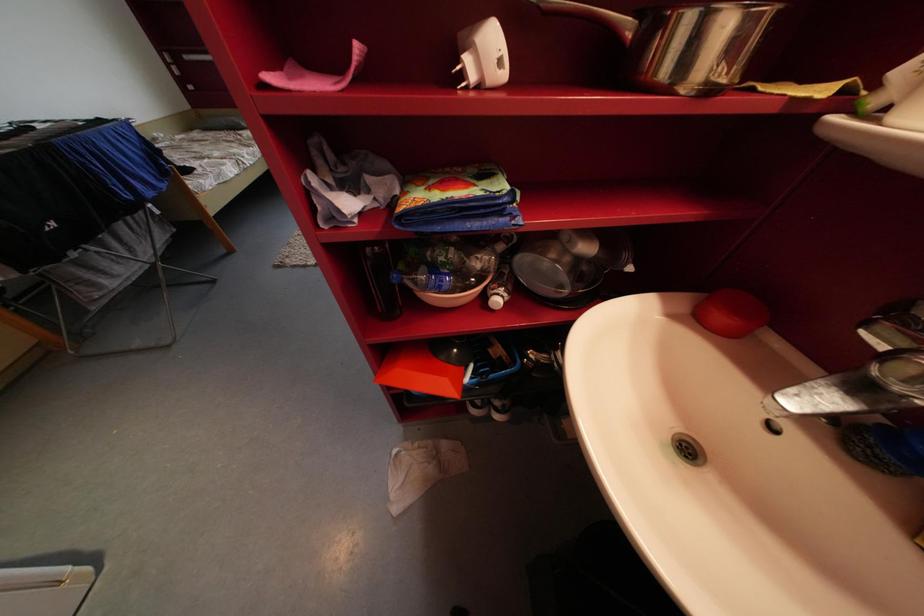
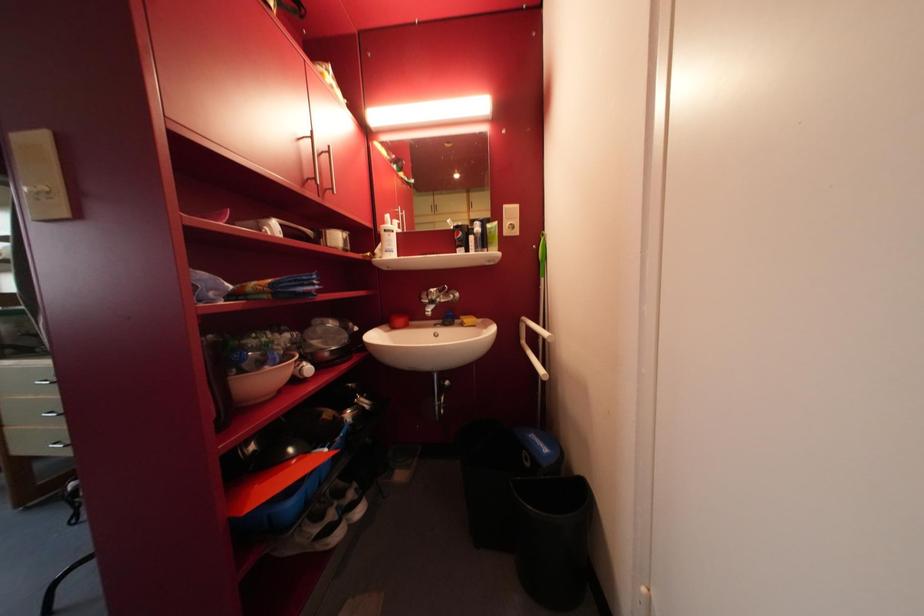
Question: How did the camera likely rotate?

Choices:
 (A) Left
 (B) Right
 (C) Up
 (D) Down

Answer: (B)